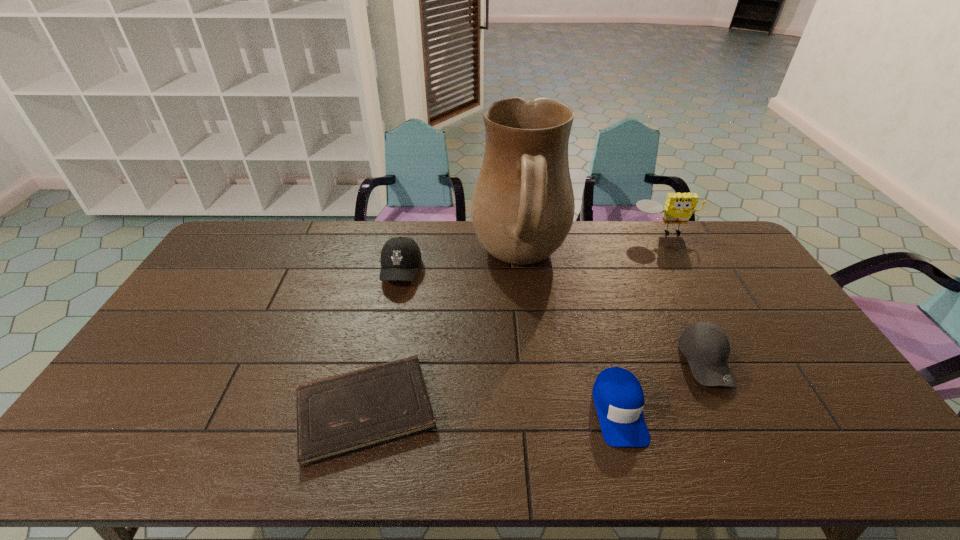
Image resolution: width=960 pixels, height=540 pixels. In order to click on the tallest object in this screenshot , I will do pyautogui.click(x=522, y=209).

Identify the location of the second tallest object. coord(679,207).

At what (x,y) coordinates should I click in order to perform the action: click on the farthest baseball cap. Please return your answer as a coordinate pair (x, y). Looking at the image, I should click on (400, 257).

The height and width of the screenshot is (540, 960). Identify the location of the rightmost baseball cap. (705, 345).

I want to click on the second baseball cap from right to left, so click(618, 396).

Identify the location of the shortest object. The width and height of the screenshot is (960, 540). (338, 415).

Locate an element on the screen. The height and width of the screenshot is (540, 960). free spot located 0.260m at the spout of the tallest object is located at coordinates (398, 261).

Where is `free space located 0.170m at the spout of the tallest object`? Image resolution: width=960 pixels, height=540 pixels. free space located 0.170m at the spout of the tallest object is located at coordinates (423, 261).

Identify the location of vacant area situated 0.140m at the spout of the tallest object. (432, 261).

Locate an element on the screen. The height and width of the screenshot is (540, 960). vacant space located on the front-facing side of the second tallest object is located at coordinates (693, 288).